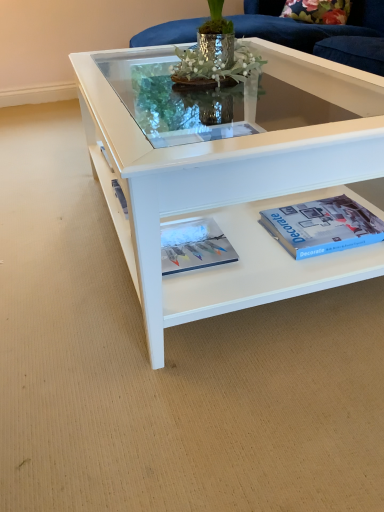
Find the location of a particular element. The height and width of the screenshot is (512, 384). empty space that is ontop of matte white magazine at center (from a real-world perspective) is located at coordinates (186, 240).